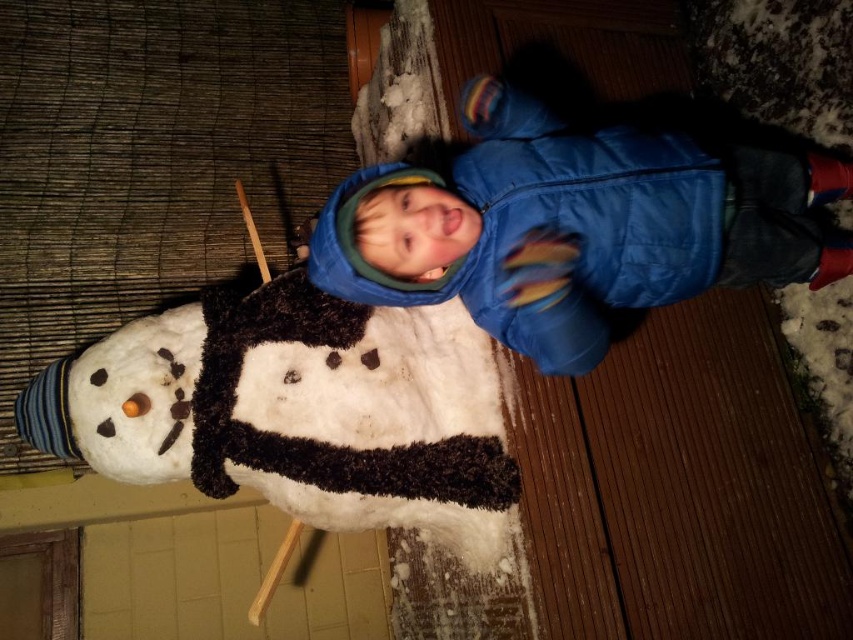
Is point (187, 312) positioned before point (390, 236)?

No, it is not.

Is point (115, 435) positioned after point (849, 260)?

No.

Is point (119, 404) positioned before point (781, 164)?

Yes.

Locate an element on the screen. This screenshot has height=640, width=853. white fluffy snowman at center is located at coordinates (296, 412).